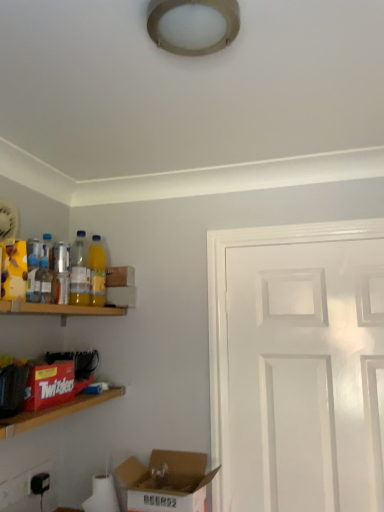
Question: From a real-world perspective, is white glossy door at right below translucent plastic bottle at left, which is the 4th bottle in back-to-front order?

Choices:
 (A) no
 (B) yes

Answer: (B)

Question: Can you confirm if white glossy door at right is taller than translucent plastic bottle at left, which is the 4th bottle in back-to-front order?

Choices:
 (A) yes
 (B) no

Answer: (A)

Question: Is translucent plastic bottle at left, which is the 4th bottle in back-to-front order, completely or partially inside white glossy door at right?

Choices:
 (A) yes
 (B) no

Answer: (B)

Question: Are white glossy door at right and translucent plastic bottle at left, which is the first bottle in front-to-back order, far apart?

Choices:
 (A) yes
 (B) no

Answer: (B)

Question: From the image's perspective, is white glossy door at right located above translucent plastic bottle at left, which is the 4th bottle in back-to-front order?

Choices:
 (A) no
 (B) yes

Answer: (A)

Question: Considering the relative sizes of white glossy door at right and translucent plastic bottle at left, which is the 4th bottle in back-to-front order, in the image provided, is white glossy door at right wider than translucent plastic bottle at left, which is the 4th bottle in back-to-front order,?

Choices:
 (A) no
 (B) yes

Answer: (B)

Question: Considering the relative sizes of translucent plastic bottle at left, placed as the third bottle when sorted from front to back, and white plastic electric outlet at lower left, which is the second electric outlet from back to front, in the image provided, is translucent plastic bottle at left, placed as the third bottle when sorted from front to back, wider than white plastic electric outlet at lower left, which is the second electric outlet from back to front,?

Choices:
 (A) no
 (B) yes

Answer: (B)

Question: Considering the relative sizes of translucent plastic bottle at left, placed as the third bottle when sorted from front to back, and white plastic electric outlet at lower left, positioned as the 1th electric outlet in left-to-right order, in the image provided, is translucent plastic bottle at left, placed as the third bottle when sorted from front to back, shorter than white plastic electric outlet at lower left, positioned as the 1th electric outlet in left-to-right order,?

Choices:
 (A) no
 (B) yes

Answer: (A)

Question: Is translucent plastic bottle at left, placed as the third bottle when sorted from front to back, in contact with white plastic electric outlet at lower left, the second electric outlet positioned from the right?

Choices:
 (A) yes
 (B) no

Answer: (B)

Question: Is translucent plastic bottle at left, placed as the third bottle when sorted from front to back, positioned in front of white plastic electric outlet at lower left, which is the second electric outlet from back to front?

Choices:
 (A) yes
 (B) no

Answer: (B)

Question: Is the depth of translucent plastic bottle at left, placed as the 2th bottle when sorted from back to front, greater than that of white plastic electric outlet at lower left, arranged as the 1th electric outlet when viewed from the front?

Choices:
 (A) no
 (B) yes

Answer: (B)

Question: Can you confirm if translucent plastic bottle at left, placed as the 2th bottle when sorted from back to front, is taller than white plastic electric outlet at lower left, arranged as the 1th electric outlet when viewed from the front?

Choices:
 (A) no
 (B) yes

Answer: (B)

Question: Is cardboard box at lower left, the first box positioned from the right, bigger than translucent plastic bottle at left, which ranks as the 3th bottle in back-to-front order?

Choices:
 (A) yes
 (B) no

Answer: (A)